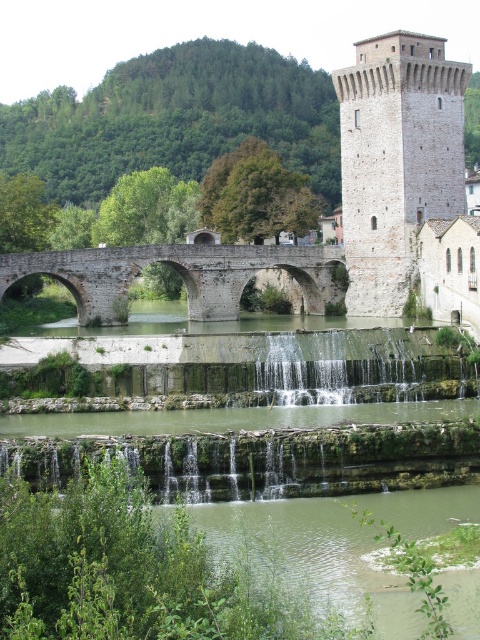
You are standing at the point with coordinates point (396, 160) in the image. What structure are you facing towards?

The point (396, 160) indicates the stone tower at center, so you are facing towards the stone tower at center.

You are an architect designing a new pathway between the stone tower at center and the white stone tower at upper right. Which tower requires more space to accommodate the pathway on its side?

The stone tower at center requires more space because its width surpasses that of the white stone tower at upper right, meaning it occupies a larger area.